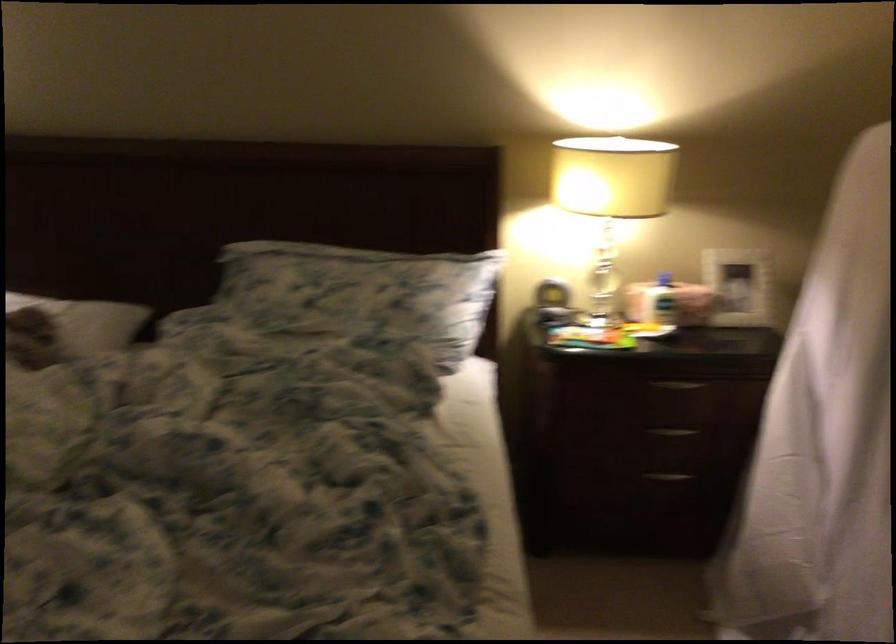
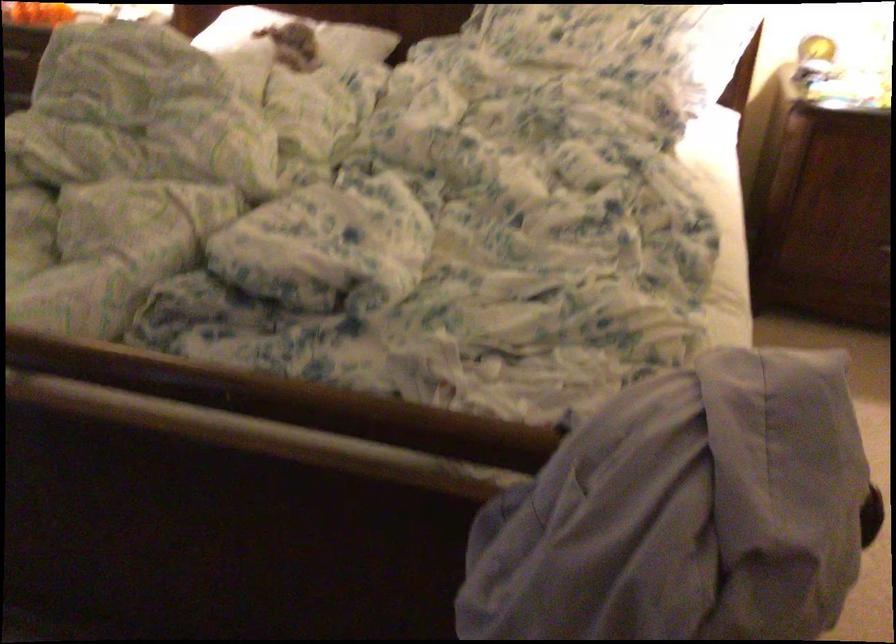
In the scene shown: Which direction would the cameraman need to move to produce the second image?

The cameraman walked toward left, backward.